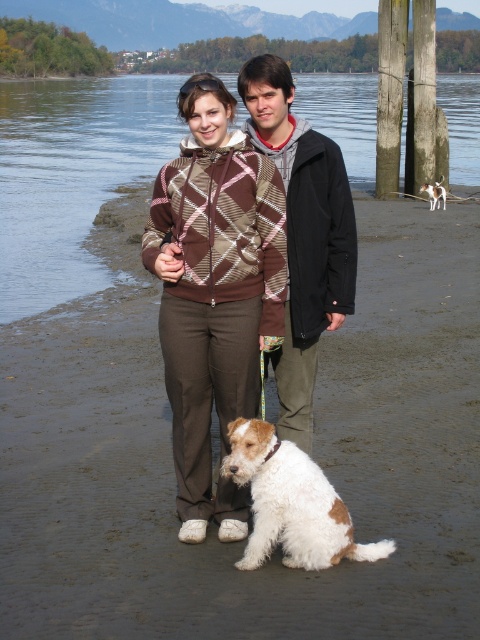
You are a photographer trying to capture a photo of the black fleece jacket at center and the white fur at lower center. Which object should you zoom in more on to ensure both are in focus, considering their sizes?

The black fleece jacket at center has a smaller width than the white fur at lower center, so you should zoom in more on the black fleece jacket at center to ensure both are in focus.